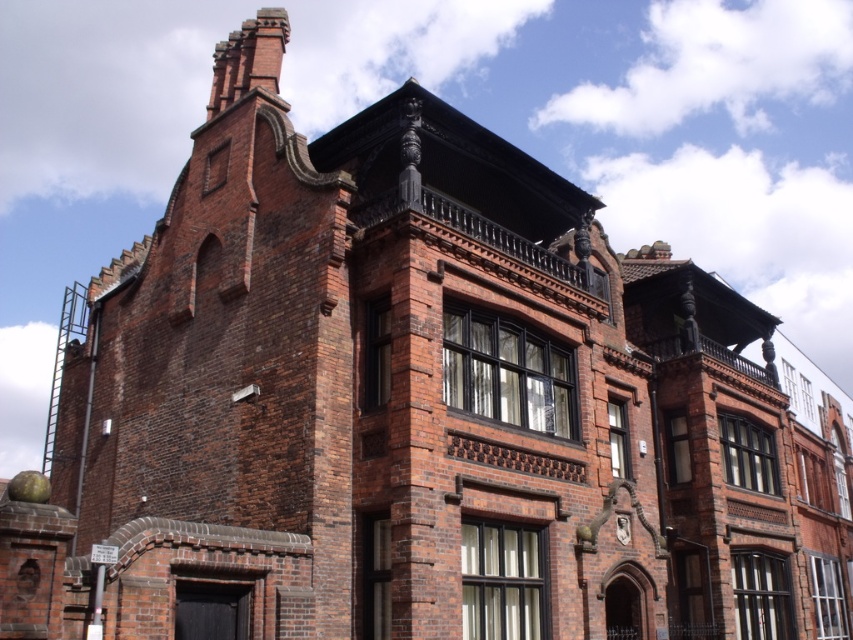
You are an architect inspecting a Victorian building. You notice the red brick chimney at upper left and the matte stone clock at upper center. Which of these two objects is taller?

The red brick chimney at upper left is taller than the matte stone clock at upper center.

You are an architect assessing the structural integrity of the Victorian building. You notice the red brick chimney at upper left and the matte stone clock at upper center. Which of these two objects has a greater width according to the architectural plans?

The red brick chimney at upper left has a greater width than the matte stone clock at upper center.